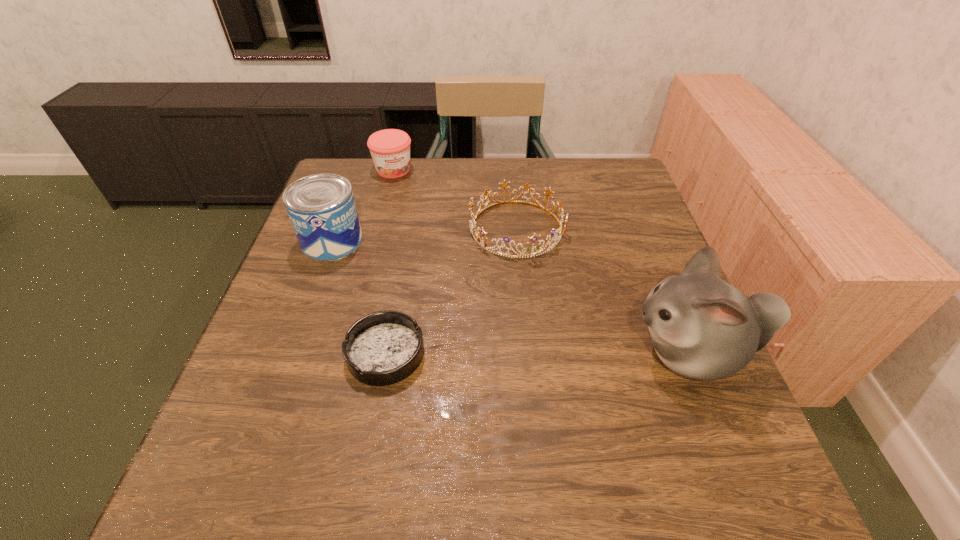
This screenshot has width=960, height=540. What are the coordinates of `vacant space at the near edge` in the screenshot? It's located at coord(549,401).

Locate an element on the screen. vacant space at the right edge of the desktop is located at coordinates (646, 277).

Identify the location of vacant point at the far right corner. This screenshot has width=960, height=540. (631, 184).

Find the location of a particular element. empty location between the tallest object and the farthest object is located at coordinates (542, 261).

Find the location of `empty location between the tallest object and the can`. empty location between the tallest object and the can is located at coordinates (512, 297).

You are a GUI agent. You are given a task and a screenshot of the screen. Output one action in this format:
    pyautogui.click(x=<x>, y=<y>)
    Task: Click on the vacant area that lies between the fourth shortest object and the shortest object
    This screenshot has height=540, width=960.
    Given the screenshot: What is the action you would take?
    pyautogui.click(x=359, y=298)

Find the location of a particular element. This screenshot has height=540, width=960. vacant space that is in between the ashtray and the can is located at coordinates (359, 298).

I want to click on empty space that is in between the shortest object and the fourth object from left to right, so click(451, 291).

Identify the location of vacant area between the can and the ashtray. [359, 298].

At what (x,y) coordinates should I click in order to perform the action: click on vacant space in between the second tallest object and the jam. Please return your answer as a coordinate pair (x, y). Looking at the image, I should click on (363, 205).